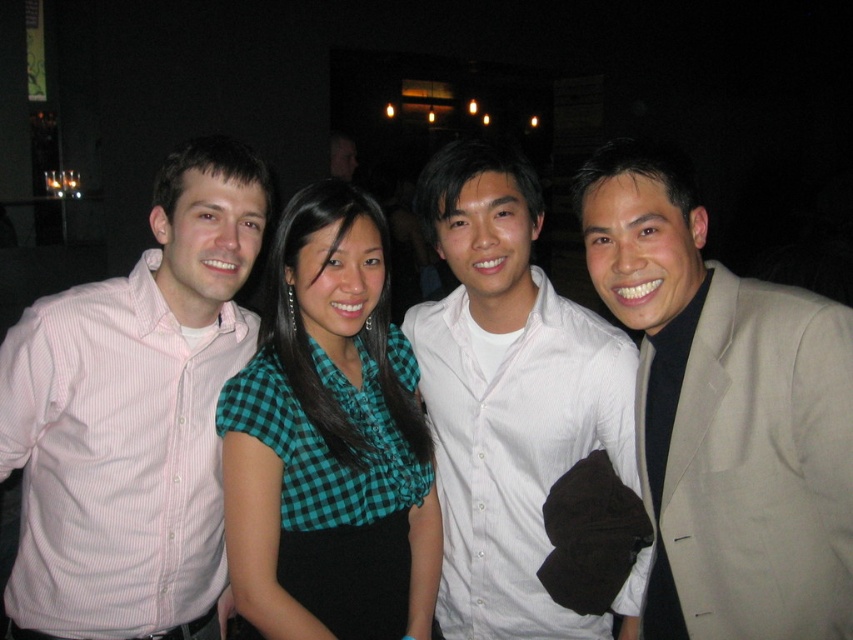
Question: Does pink striped shirt at left come behind tan fabric suit at right?

Choices:
 (A) no
 (B) yes

Answer: (B)

Question: Can you confirm if pink striped shirt at left is wider than green checkered blouse at center?

Choices:
 (A) yes
 (B) no

Answer: (A)

Question: Which point is farther from the camera taking this photo?

Choices:
 (A) (78, 634)
 (B) (538, 636)

Answer: (B)

Question: Is tan fabric suit at right below green checkered blouse at center?

Choices:
 (A) no
 (B) yes

Answer: (A)

Question: Estimate the real-world distances between objects in this image. Which object is closer to the tan fabric suit at right?

Choices:
 (A) white textured shirt at center
 (B) pink striped shirt at left
 (C) green checkered blouse at center

Answer: (A)

Question: Which point appears closest to the camera in this image?

Choices:
 (A) (732, 404)
 (B) (523, 536)

Answer: (A)